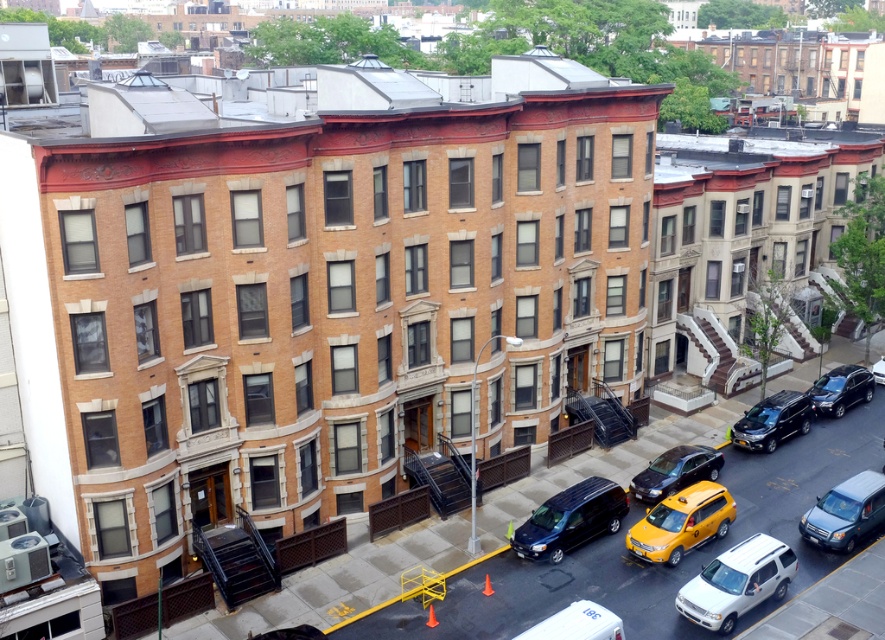
You are standing at the point labeled point (882, 356). You want to walk to the point labeled point (595, 513). Which direction should you move relative to your current position?

You should move forward because point (595, 513) is in front of point (882, 356).